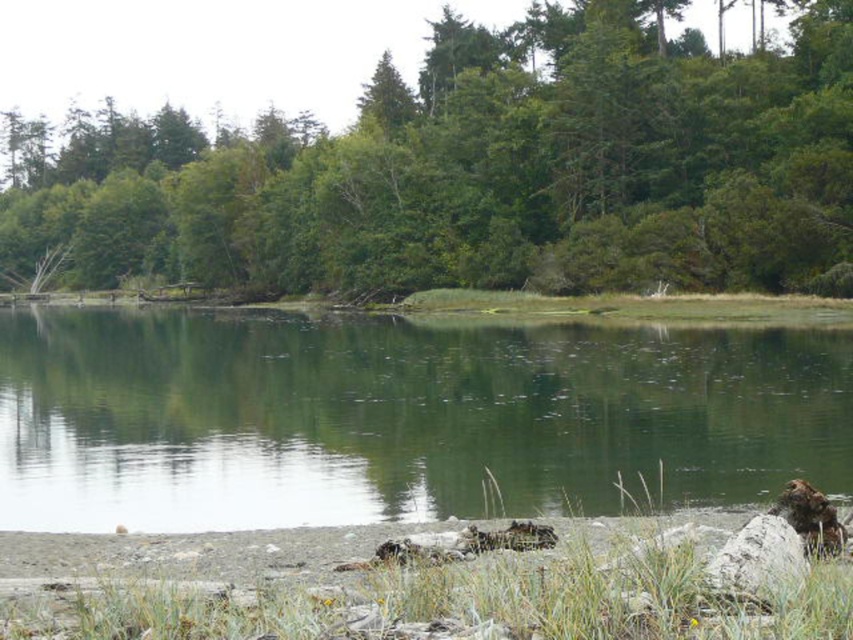
Which of these two, green leafy tree at center or white smooth rock at lower right, stands taller?

green leafy tree at center is taller.

Based on the photo, does green leafy tree at center appear on the right side of white smooth rock at lower right?

In fact, green leafy tree at center is to the left of white smooth rock at lower right.

Locate an element on the screen. The height and width of the screenshot is (640, 853). green leafy tree at center is located at coordinates (474, 170).

This screenshot has height=640, width=853. What are the coordinates of `green leafy tree at center` in the screenshot? It's located at (474, 170).

Does green leafy tree at center have a lesser width compared to green reflective water at center?

No, green leafy tree at center is not thinner than green reflective water at center.

Who is more forward, (x=833, y=141) or (x=233, y=403)?

Point (x=233, y=403) is more forward.

Between point (178, 243) and point (251, 369), which one is positioned in front?

Point (251, 369)

At what (x,y) coordinates should I click in order to perform the action: click on green leafy tree at center. Please return your answer as a coordinate pair (x, y). Image resolution: width=853 pixels, height=640 pixels. Looking at the image, I should click on (474, 170).

Can you confirm if green reflective water at center is positioned to the left of white smooth rock at lower right?

Yes, green reflective water at center is to the left of white smooth rock at lower right.

Is green reflective water at center positioned behind white smooth rock at lower right?

Yes, it is.

Image resolution: width=853 pixels, height=640 pixels. Identify the location of green reflective water at center. (398, 417).

Where is `green reflective water at center`? This screenshot has height=640, width=853. green reflective water at center is located at coordinates (398, 417).